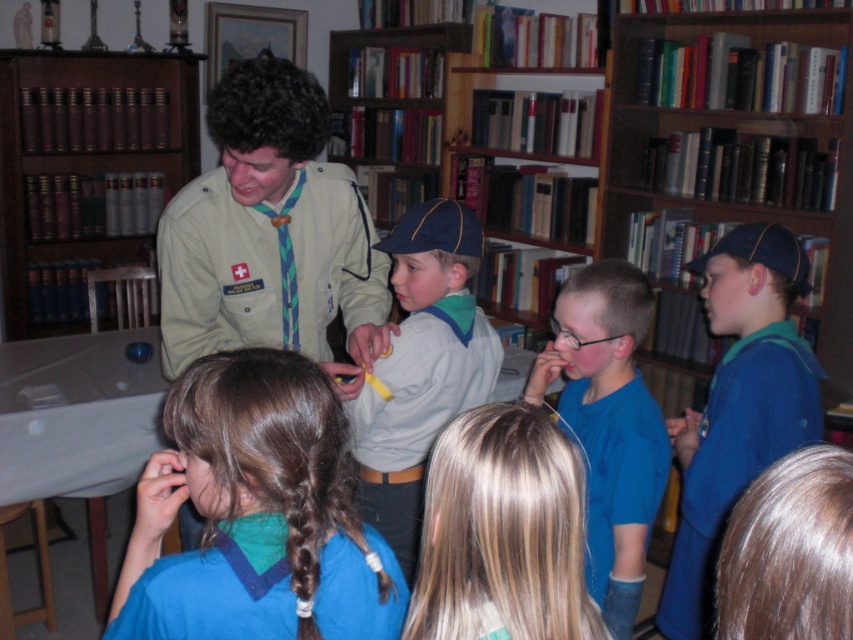
Between blue matte uniform at center and light gray sweater at center, which one is positioned lower?

blue matte uniform at center

Who is shorter, blue matte uniform at center or light gray sweater at center?

With less height is blue matte uniform at center.

Does point (276, 481) come in front of point (445, 305)?

Yes, it is.

The width and height of the screenshot is (853, 640). I want to click on blue matte uniform at center, so click(254, 515).

Can you confirm if light green uniform at center is bigger than blonde hair at lower right?

Yes, light green uniform at center is bigger than blonde hair at lower right.

Is light green uniform at center positioned behind blonde hair at lower right?

Yes, light green uniform at center is behind blonde hair at lower right.

In order to click on light green uniform at center in this screenshot , I will do `click(270, 234)`.

Where is `light green uniform at center`? The height and width of the screenshot is (640, 853). light green uniform at center is located at coordinates (270, 234).

Does wooden bookshelf at upper center appear under blonde hair at lower right?

No.

Which is more to the right, wooden bookshelf at upper center or blonde hair at lower right?

wooden bookshelf at upper center

Does point (786, 147) come behind point (730, 563)?

Yes.

At what (x,y) coordinates should I click in order to perform the action: click on wooden bookshelf at upper center. Please return your answer as a coordinate pair (x, y). Looking at the image, I should click on (740, 138).